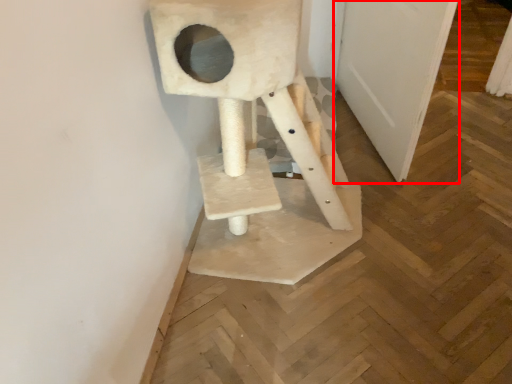
Question: In this image, where is door (annotated by the red box) located relative to sculpture?

Choices:
 (A) left
 (B) right

Answer: (B)